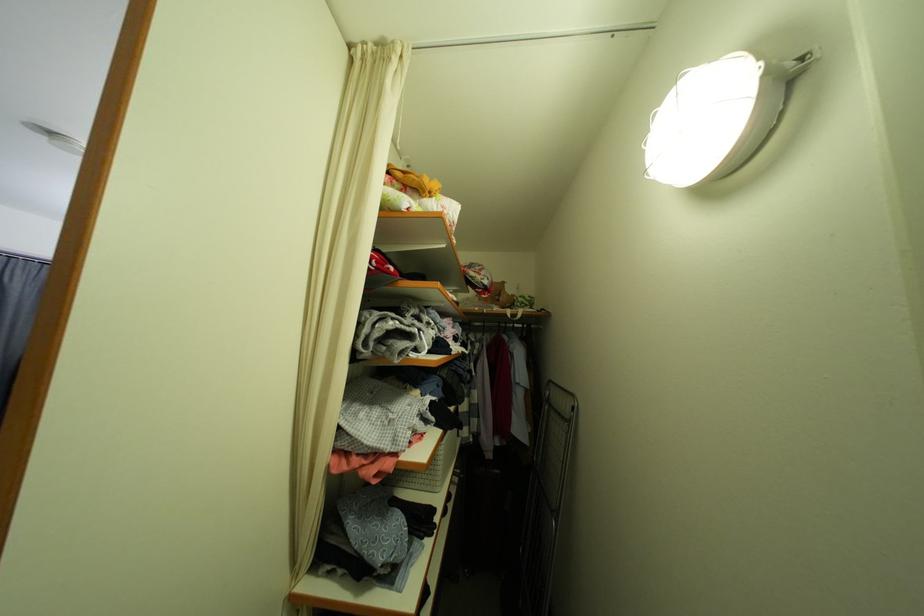
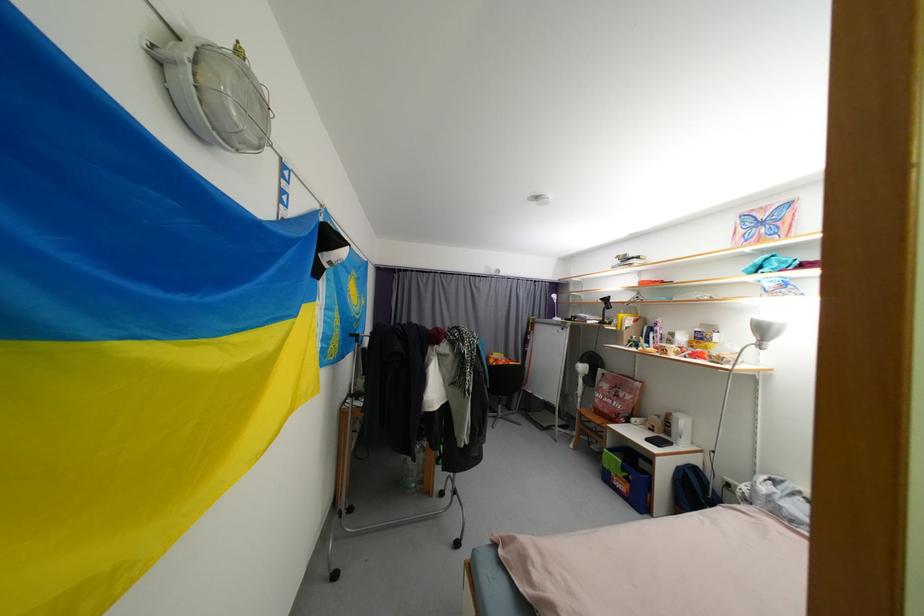
Question: The first image is from the beginning of the video and the second image is from the end. How did the camera likely rotate when shooting the video?

Choices:
 (A) Left
 (B) Right
 (C) Up
 (D) Down

Answer: (A)